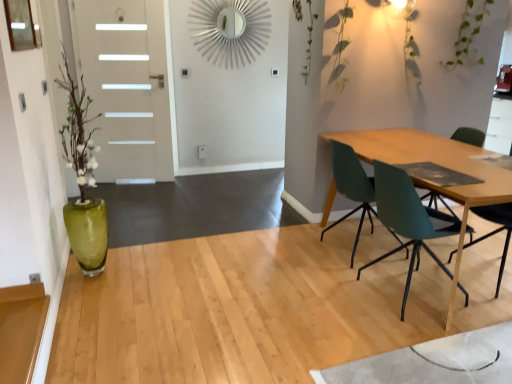
Question: From the image's perspective, would you say white glossy door at left is shown under teal matte chair at right, which is the first chair from back to front?

Choices:
 (A) yes
 (B) no

Answer: (B)

Question: Is white glossy door at left next to teal matte chair at right, which is the first chair from back to front, and touching it?

Choices:
 (A) yes
 (B) no

Answer: (B)

Question: Does white glossy door at left contain teal matte chair at right, the second chair positioned from the front?

Choices:
 (A) no
 (B) yes

Answer: (A)

Question: Is white glossy door at left located outside teal matte chair at right, which is the first chair from back to front?

Choices:
 (A) yes
 (B) no

Answer: (A)

Question: Considering the relative sizes of white glossy door at left and teal matte chair at right, the second chair positioned from the front, in the image provided, is white glossy door at left shorter than teal matte chair at right, the second chair positioned from the front,?

Choices:
 (A) yes
 (B) no

Answer: (B)

Question: Is white glossy door at left closer to the viewer compared to teal matte chair at right, the second chair positioned from the front?

Choices:
 (A) yes
 (B) no

Answer: (B)

Question: Is white glossy door at left not inside teal plastic chair at right, which is the 1th chair in front-to-back order?

Choices:
 (A) yes
 (B) no

Answer: (A)

Question: Is white glossy door at left closer to the viewer compared to teal plastic chair at right, which is the 1th chair in front-to-back order?

Choices:
 (A) yes
 (B) no

Answer: (B)

Question: Does white glossy door at left have a smaller size compared to teal plastic chair at right, the 2th chair in the back-to-front sequence?

Choices:
 (A) no
 (B) yes

Answer: (A)

Question: Is the position of white glossy door at left more distant than that of teal plastic chair at right, the 2th chair in the back-to-front sequence?

Choices:
 (A) yes
 (B) no

Answer: (A)

Question: Does white glossy door at left have a greater width compared to teal plastic chair at right, which is the 1th chair in front-to-back order?

Choices:
 (A) no
 (B) yes

Answer: (A)

Question: Considering the relative sizes of white glossy door at left and teal plastic chair at right, which is the 1th chair in front-to-back order, in the image provided, is white glossy door at left taller than teal plastic chair at right, which is the 1th chair in front-to-back order,?

Choices:
 (A) no
 (B) yes

Answer: (B)

Question: Would you consider teal matte chair at right, the second chair positioned from the front, to be distant from white glossy door at left?

Choices:
 (A) no
 (B) yes

Answer: (B)